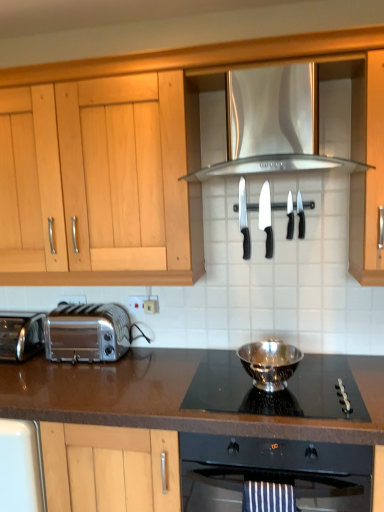
Question: From the image's perspective, is shiny metallic toaster at left, arranged as the first toaster when viewed from the right, above or below silver metallic toaster at lower left, which is counted as the 2th toaster, starting from the right?

Choices:
 (A) above
 (B) below

Answer: (A)

Question: Considering the positions of shiny metallic toaster at left, marked as the second toaster in a left-to-right arrangement, and silver metallic toaster at lower left, which appears as the first toaster when viewed from the left, in the image, is shiny metallic toaster at left, marked as the second toaster in a left-to-right arrangement, bigger or smaller than silver metallic toaster at lower left, which appears as the first toaster when viewed from the left,?

Choices:
 (A) small
 (B) big

Answer: (B)

Question: Estimate the real-world distances between objects in this image. Which object is closer to the white plastic electric outlet at center, the first electric outlet in the back-to-front sequence?

Choices:
 (A) silver metallic bowl at center
 (B) polished stainless steel bowl at center
 (C) black plastic knife at center, the second knife viewed from the left
 (D) brown laminate countertop at center
 (E) satin silver exhaust hood at upper center

Answer: (D)

Question: Which object is the farthest from the shiny metallic toaster at left, arranged as the first toaster when viewed from the right?

Choices:
 (A) black plastic knife at center, acting as the 2th knife starting from the right
 (B) white plastic electric outlet at center, placed as the 1th electric outlet when sorted from left to right
 (C) satin silver exhaust hood at upper center
 (D) brown laminate countertop at center
 (E) silver metallic bowl at center

Answer: (A)